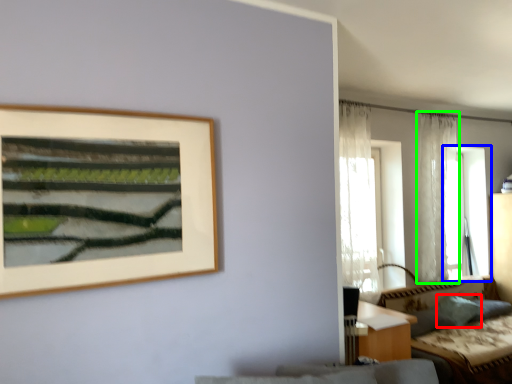
Question: Estimate the real-world distances between objects in this image. Which object is closer to pillow (highlighted by a red box), window (highlighted by a blue box) or curtain (highlighted by a green box)?

Choices:
 (A) window
 (B) curtain

Answer: (B)